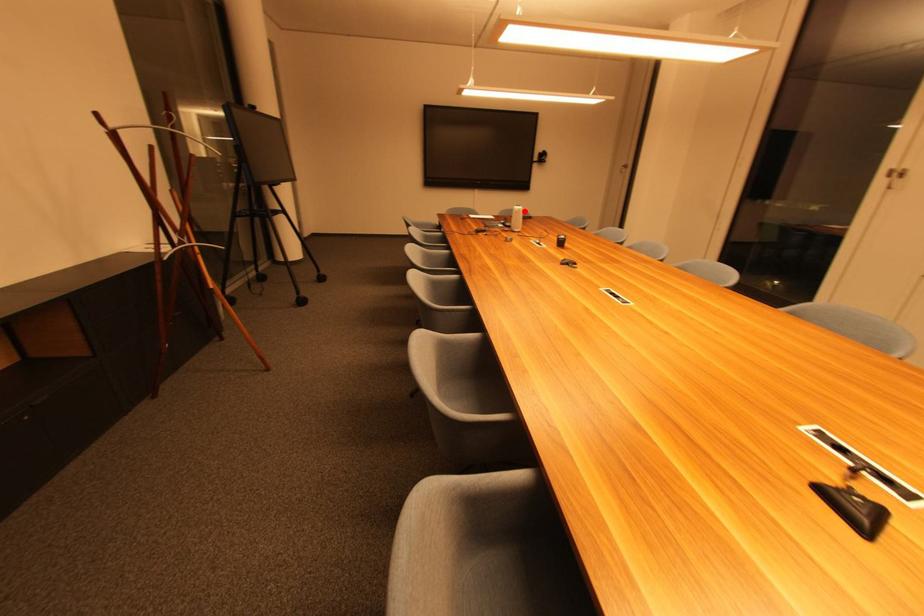
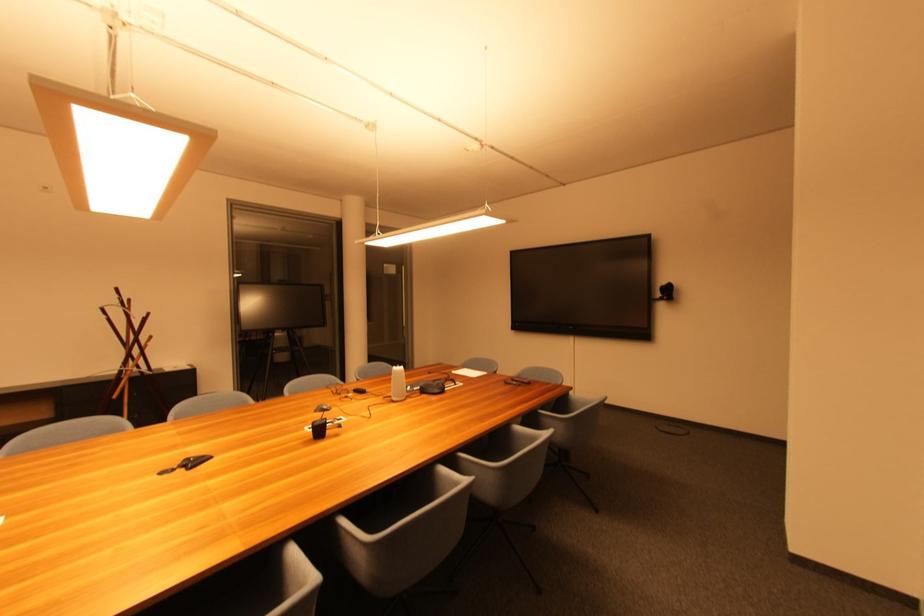
In the second image, find the point that corresponds to the highlighted location in the first image.

(399, 373)